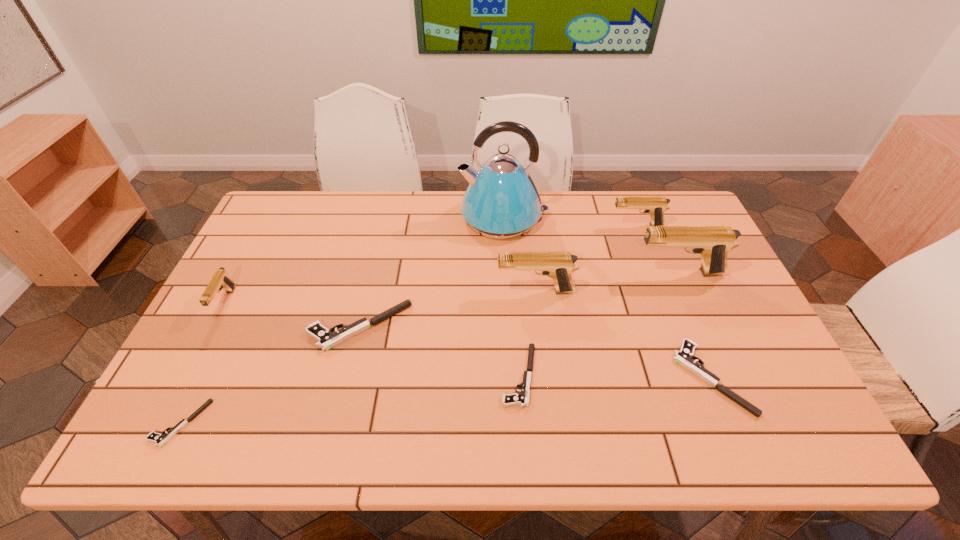
You are a GUI agent. You are given a task and a screenshot of the screen. Output one action in this format:
    pyautogui.click(x=<x>, y=<y>)
    Task: Click on the free area in between the farthest pistol and the second shortest object
    Image resolution: width=960 pixels, height=540 pixels.
    Given the screenshot: What is the action you would take?
    pyautogui.click(x=578, y=301)

I want to click on the second closest object relative to the second tan pistol from left to right, so click(x=712, y=243).

Find the location of `object that is the second closest to the third biggest black pistol`. object that is the second closest to the third biggest black pistol is located at coordinates (326, 338).

You are a GUI agent. You are given a task and a screenshot of the screen. Output one action in this format:
    pyautogui.click(x=<x>, y=<y>)
    Task: Click on the pistol that is the fourth closest to the second black pistol from right to left
    The width and height of the screenshot is (960, 540).
    Given the screenshot: What is the action you would take?
    pyautogui.click(x=712, y=243)

Find the location of a particular element. pistol object that ranks as the seventh closest to the rightmost black pistol is located at coordinates (220, 280).

The height and width of the screenshot is (540, 960). In order to click on the closest tan pistol to the rightmost black pistol in this screenshot , I will do (x=712, y=243).

Locate which tan pistol ranks in proximity to the rightmost black pistol. Please provide its 2D coordinates. Your answer should be formatted as a tuple, i.e. [(x, y)], where the tuple contains the x and y coordinates of a point satisfying the conditions above.

[(712, 243)]

Identify which black pistol is the second nearest to the second shortest object. Please provide its 2D coordinates. Your answer should be formatted as a tuple, i.e. [(x, y)], where the tuple contains the x and y coordinates of a point satisfying the conditions above.

[(684, 357)]

Where is `black pistol that stands as the third closest to the kettle`? black pistol that stands as the third closest to the kettle is located at coordinates click(684, 357).

This screenshot has width=960, height=540. I want to click on free location that satisfies the following two spatial constraints: 1. at the barrel of the farthest tan pistol; 2. at the barrel of the leftmost tan pistol, so click(666, 302).